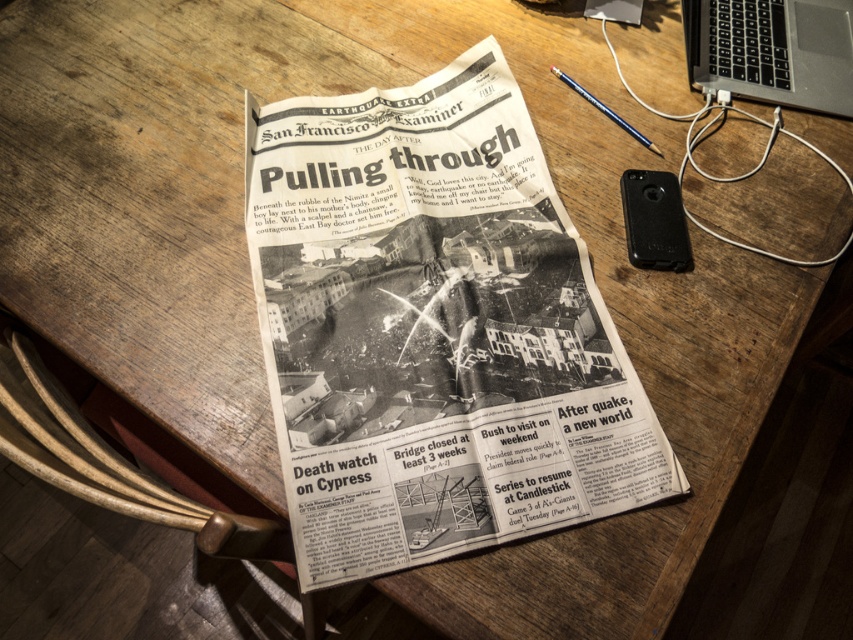
You are a delivery person who needs to place a 16 inch long package between the black newspaper at center and the black plastic laptop at upper right on the table. Can you fit the package between them without moving either item?

The distance between the black newspaper at center and the black plastic laptop at upper right is 15.90 inches. Since the package is 16 inches long, it cannot fit between them as the space is slightly shorter than the package.

You are organizing items on a wooden table. You need to place a black plastic laptop at upper right and a black newspaper at center. According to the scene, which item is located to the left of the other?

The black newspaper at center is positioned on the left side of black plastic laptop at upper right, so the black newspaper at center is to the left of the black plastic laptop at upper right.